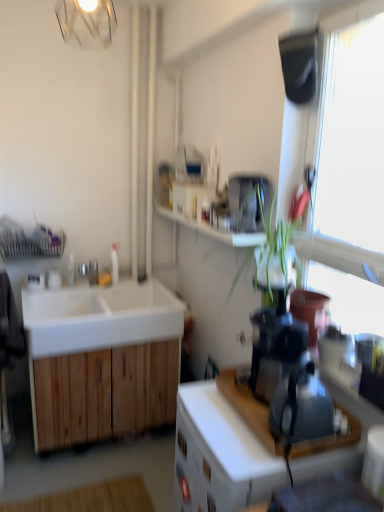
The image size is (384, 512). Describe the element at coordinates (348, 169) in the screenshot. I see `transparent glass window at upper right` at that location.

The image size is (384, 512). Describe the element at coordinates (105, 393) in the screenshot. I see `white wood cabinet at left, which ranks as the 2th cabinetry in front-to-back order` at that location.

The image size is (384, 512). What do you see at coordinates (8, 349) in the screenshot?
I see `dark gray fabric swivel chair at left` at bounding box center [8, 349].

Identify the location of white matte drawer at center. (206, 466).

Would you say clear glass light fixture at upper center is a long distance from dark gray fabric swivel chair at left?

Indeed, clear glass light fixture at upper center is not near dark gray fabric swivel chair at left.

Which of these two, clear glass light fixture at upper center or dark gray fabric swivel chair at left, is wider?

clear glass light fixture at upper center is wider.

From the image's perspective, is clear glass light fixture at upper center positioned above or below dark gray fabric swivel chair at left?

From the image's perspective, clear glass light fixture at upper center appears above dark gray fabric swivel chair at left.

Is clear glass light fixture at upper center to the right of dark gray fabric swivel chair at left from the viewer's perspective?

Yes.

Could you measure the distance between white wood cabinet at left, which ranks as the 2th cabinetry in front-to-back order, and dark gray fabric swivel chair at left?

18.37 inches.

Consider the image. How different are the orientations of white wood cabinet at left, which ranks as the 2th cabinetry in front-to-back order, and dark gray fabric swivel chair at left in degrees?

There is a 88.8-degree angle between the facing directions of white wood cabinet at left, which ranks as the 2th cabinetry in front-to-back order, and dark gray fabric swivel chair at left.

Consider the image. Is white wood cabinet at left, which is the second cabinetry from right to left, directly adjacent to dark gray fabric swivel chair at left?

white wood cabinet at left, which is the second cabinetry from right to left, and dark gray fabric swivel chair at left are not in contact.

Image resolution: width=384 pixels, height=512 pixels. What are the coordinates of `the 2nd cabinetry located beneath the dark gray fabric swivel chair at left (from a real-world perspective)` in the screenshot? It's located at (105, 393).

Does white wood cabinet at left, which ranks as the 2th cabinetry in front-to-back order, appear on the right side of white wood cabinet at center, which is the 2th cabinetry from left to right?

Incorrect, white wood cabinet at left, which ranks as the 2th cabinetry in front-to-back order, is not on the right side of white wood cabinet at center, which is the 2th cabinetry from left to right.

From the picture: Choose the correct answer: Is white wood cabinet at left, which is the second cabinetry from right to left, inside white wood cabinet at center, which is counted as the first cabinetry, starting from the right, or outside it?

white wood cabinet at left, which is the second cabinetry from right to left, lies outside white wood cabinet at center, which is counted as the first cabinetry, starting from the right.

From a real-world perspective, which is physically above, white wood cabinet at left, which ranks as the 2th cabinetry in front-to-back order, or white wood cabinet at center, arranged as the 1th cabinetry when viewed from the front?

white wood cabinet at center, arranged as the 1th cabinetry when viewed from the front, is physically above.

Considering the relative positions of white matte sink at left and black plastic blender at right, which is the 2th appliance from back to front, in the image provided, is white matte sink at left to the left or to the right of black plastic blender at right, which is the 2th appliance from back to front,?

Based on their positions, white matte sink at left is located to the left of black plastic blender at right, which is the 2th appliance from back to front.

Who is more distant, white matte sink at left or black plastic blender at right, the 1th appliance from the bottom?

white matte sink at left is further from the camera.

How far apart are white matte sink at left and black plastic blender at right, which ranks as the second appliance in top-to-bottom order?

A distance of 4.01 feet exists between white matte sink at left and black plastic blender at right, which ranks as the second appliance in top-to-bottom order.

Can black plastic blender at right, which is the 2th appliance from back to front, be found inside white matte sink at left?

No.

Is white wood cabinet at center, which is the 2th cabinetry from left to right, further to camera compared to clear glass light fixture at upper center?

That is False.

Are white wood cabinet at center, which is the 2th cabinetry from left to right, and clear glass light fixture at upper center making contact?

There is a gap between white wood cabinet at center, which is the 2th cabinetry from left to right, and clear glass light fixture at upper center.

Is white wood cabinet at center, which is the 2th cabinetry from left to right, to the left of clear glass light fixture at upper center from the viewer's perspective?

No, white wood cabinet at center, which is the 2th cabinetry from left to right, is not to the left of clear glass light fixture at upper center.

Find the location of a particular element. cabinetry on the right of clear glass light fixture at upper center is located at coordinates (223, 448).

Is white wood cabinet at left, which is the second cabinetry from right to left, next to white matte drawer at center and touching it?

No, white wood cabinet at left, which is the second cabinetry from right to left, is not making contact with white matte drawer at center.

Visually, is white wood cabinet at left, which ranks as the 2th cabinetry in front-to-back order, positioned to the left or to the right of white matte drawer at center?

white wood cabinet at left, which ranks as the 2th cabinetry in front-to-back order, is to the left of white matte drawer at center.

Is metallic silver toaster at upper center, which is counted as the second appliance, starting from the front, outside of white wood cabinet at center, arranged as the 1th cabinetry when viewed from the front?

metallic silver toaster at upper center, which is counted as the second appliance, starting from the front, is positioned outside white wood cabinet at center, arranged as the 1th cabinetry when viewed from the front.

Looking at this image, between metallic silver toaster at upper center, acting as the 2th appliance starting from the bottom, and white wood cabinet at center, which is counted as the first cabinetry, starting from the right, which one has smaller width?

With smaller width is metallic silver toaster at upper center, acting as the 2th appliance starting from the bottom.

Considering the sizes of metallic silver toaster at upper center, which is counted as the second appliance, starting from the front, and white wood cabinet at center, arranged as the 1th cabinetry when viewed from the front, in the image, is metallic silver toaster at upper center, which is counted as the second appliance, starting from the front, bigger or smaller than white wood cabinet at center, arranged as the 1th cabinetry when viewed from the front,?

Clearly, metallic silver toaster at upper center, which is counted as the second appliance, starting from the front, is smaller in size than white wood cabinet at center, arranged as the 1th cabinetry when viewed from the front.

Identify the location of swivel chair that appears below the clear glass light fixture at upper center (from the image's perspective). (8, 349).

At what (x,y) coordinates should I click in order to perform the action: click on swivel chair above the white wood cabinet at left, the 1th cabinetry viewed from the left (from the image's perspective). Please return your answer as a coordinate pair (x, y). The image size is (384, 512). Looking at the image, I should click on (8, 349).

Based on their spatial positions, is metallic silver toaster at upper center, acting as the 2th appliance starting from the bottom, or white matte sink at left closer to black plastic blender at right, the 1th appliance from the bottom?

metallic silver toaster at upper center, acting as the 2th appliance starting from the bottom, lies closer to black plastic blender at right, the 1th appliance from the bottom, than the other object.

Based on their spatial positions, is dark gray fabric swivel chair at left or white matte drawer at center further from black plastic blender at right, which is the 2th appliance from back to front?

dark gray fabric swivel chair at left is further to black plastic blender at right, which is the 2th appliance from back to front.

When comparing their distances from transparent glass window at upper right, does white wood cabinet at left, the 1th cabinetry viewed from the left, or white matte sink at left seem closer?

white matte sink at left lies closer to transparent glass window at upper right than the other object.

Consider the image. Estimate the real-world distances between objects in this image. Which object is further from metallic silver toaster at upper center, acting as the first appliance starting from the top, clear glass light fixture at upper center or black plastic blender at right, which is the 2th appliance from back to front?

clear glass light fixture at upper center lies further to metallic silver toaster at upper center, acting as the first appliance starting from the top, than the other object.

Based on their spatial positions, is transparent glass window at upper right or dark gray fabric swivel chair at left closer to white matte sink at left?

Based on the image, dark gray fabric swivel chair at left appears to be nearer to white matte sink at left.

From the image, which object appears to be farther from transparent glass window at upper right, white matte sink at left or metallic silver toaster at upper center, the first appliance when ordered from back to front?

The object further to transparent glass window at upper right is white matte sink at left.

From the picture: Which object lies nearer to the anchor point black plastic blender at right, the 1th appliance from the bottom, transparent glass window at upper right or white matte sink at left?

The object closer to black plastic blender at right, the 1th appliance from the bottom, is transparent glass window at upper right.

Which object lies nearer to the anchor point transparent glass window at upper right, white matte drawer at center or metallic silver toaster at upper center, acting as the first appliance starting from the top?

metallic silver toaster at upper center, acting as the first appliance starting from the top.

At what (x,y) coordinates should I click in order to perform the action: click on sink between transparent glass window at upper right and white wood cabinet at center, which is the 2th cabinetry from left to right, in the vertical direction. Please return your answer as a coordinate pair (x, y). The image size is (384, 512). Looking at the image, I should click on (100, 317).

This screenshot has width=384, height=512. I want to click on sink between metallic silver toaster at upper center, which is counted as the second appliance, starting from the front, and white wood cabinet at center, which is the 2th cabinetry from left to right, in the vertical direction, so click(100, 317).

At what (x,y) coordinates should I click in order to perform the action: click on coffee machine between white matte sink at left and black plastic blender at right, which is the 2th appliance from back to front, from left to right. Please return your answer as a coordinate pair (x, y). The width and height of the screenshot is (384, 512). Looking at the image, I should click on (275, 346).

Where is `coffee machine between clear glass light fixture at upper center and white matte drawer at center from top to bottom`? coffee machine between clear glass light fixture at upper center and white matte drawer at center from top to bottom is located at coordinates (275, 346).